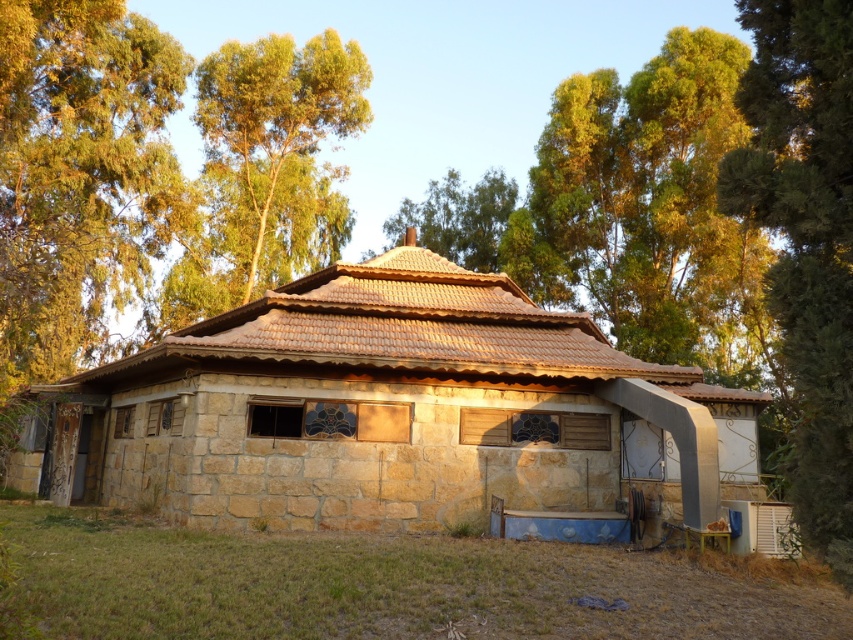
You are standing in the middle of a forest clearing and see the brown stone hut at center and the green leafy tree at upper left. Which object is closer to you?

The brown stone hut at center is closer to you because it is positioned under the green leafy tree at upper left, indicating it is in front of the tree.

You are standing in front of the rustic stone house and notice two points marked on the house wall. The first point is at coordinate point(480,298) and the second is at point(264,208). Which of these two points is closer to you?

Point(480,298) is in front of point(264,208), so it is closer to you.